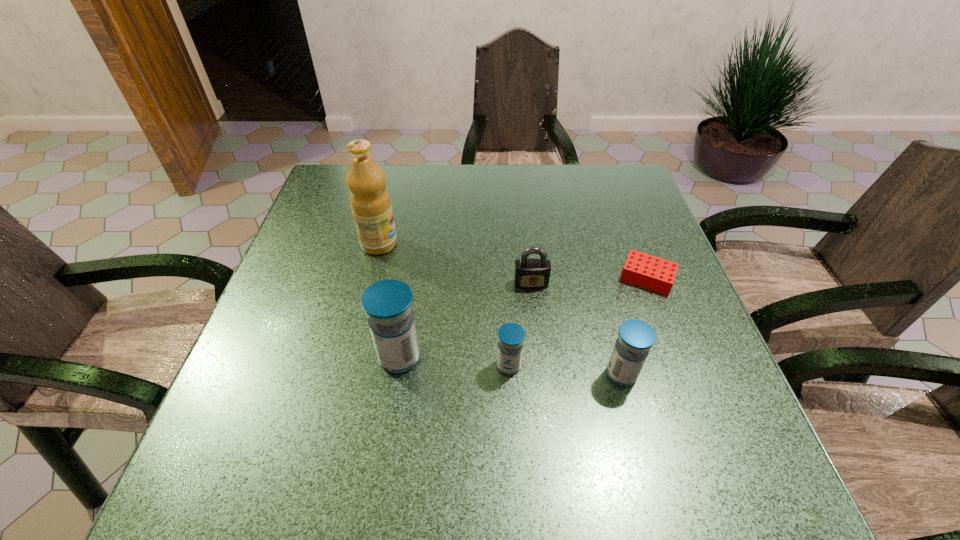
Image resolution: width=960 pixels, height=540 pixels. What are the coordinates of `free space that satisfies the following two spatial constraints: 1. on the back side of the second tallest medicine; 2. on the label of the farthest object` in the screenshot? It's located at (588, 244).

Where is `free space in the image that satisfies the following two spatial constraints: 1. on the label of the tallest object; 2. on the right side of the second object from left to right`? free space in the image that satisfies the following two spatial constraints: 1. on the label of the tallest object; 2. on the right side of the second object from left to right is located at coordinates (351, 357).

The height and width of the screenshot is (540, 960). Identify the location of vacant space that satisfies the following two spatial constraints: 1. on the front of the padlock near the keyhole; 2. on the right side of the second tallest medicine. (541, 374).